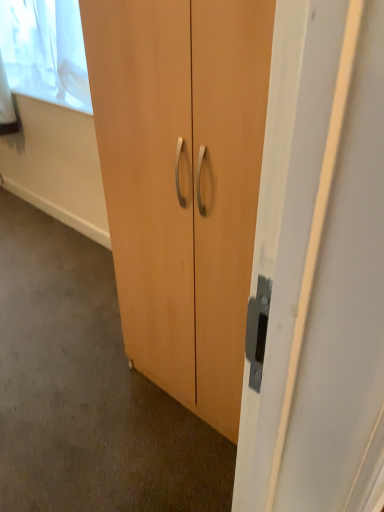
Question: From the image's perspective, would you say white sheer curtain at upper left is shown under matte wood cabinet at center?

Choices:
 (A) no
 (B) yes

Answer: (A)

Question: From a real-world perspective, does white sheer curtain at upper left stand above matte wood cabinet at center?

Choices:
 (A) yes
 (B) no

Answer: (A)

Question: Are white sheer curtain at upper left and matte wood cabinet at center located far from each other?

Choices:
 (A) no
 (B) yes

Answer: (B)

Question: Is white sheer curtain at upper left with matte wood cabinet at center?

Choices:
 (A) yes
 (B) no

Answer: (B)

Question: Is white sheer curtain at upper left surrounding matte wood cabinet at center?

Choices:
 (A) no
 (B) yes

Answer: (A)

Question: In terms of size, does matte wood cabinet at center appear bigger or smaller than matte wood cupboard at center?

Choices:
 (A) small
 (B) big

Answer: (A)

Question: From the image's perspective, relative to matte wood cupboard at center, is matte wood cabinet at center above or below?

Choices:
 (A) below
 (B) above

Answer: (A)

Question: Is matte wood cabinet at center wider or thinner than matte wood cupboard at center?

Choices:
 (A) wide
 (B) thin

Answer: (A)

Question: Is matte wood cabinet at center situated inside matte wood cupboard at center or outside?

Choices:
 (A) outside
 (B) inside

Answer: (A)

Question: From the image's perspective, relative to white sheer curtain at upper left, is matte wood cabinet at center above or below?

Choices:
 (A) below
 (B) above

Answer: (A)

Question: Which is correct: matte wood cabinet at center is inside white sheer curtain at upper left, or outside of it?

Choices:
 (A) outside
 (B) inside

Answer: (A)

Question: Considering the relative positions of matte wood cabinet at center and white sheer curtain at upper left in the image provided, is matte wood cabinet at center to the left or to the right of white sheer curtain at upper left?

Choices:
 (A) left
 (B) right

Answer: (A)

Question: From a real-world perspective, is matte wood cabinet at center above or below white sheer curtain at upper left?

Choices:
 (A) below
 (B) above

Answer: (A)

Question: Considering the positions of white sheer curtain at upper left and matte wood cupboard at center in the image, is white sheer curtain at upper left wider or thinner than matte wood cupboard at center?

Choices:
 (A) thin
 (B) wide

Answer: (A)

Question: Considering the positions of white sheer curtain at upper left and matte wood cupboard at center in the image, is white sheer curtain at upper left taller or shorter than matte wood cupboard at center?

Choices:
 (A) short
 (B) tall

Answer: (A)